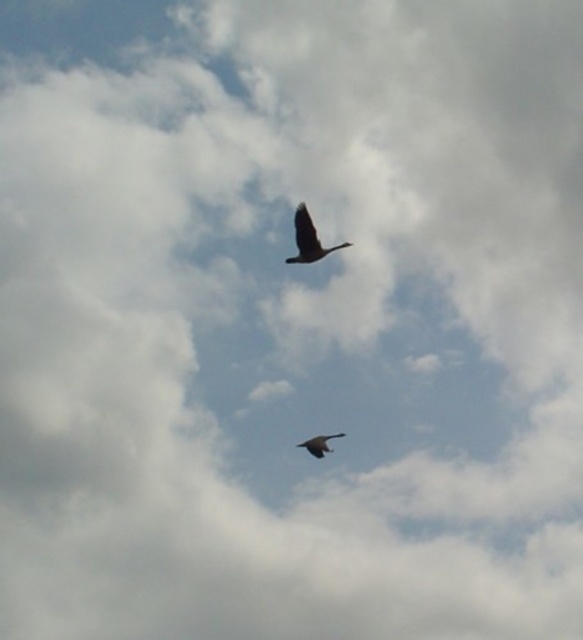
You are a birdwatcher observing the scene. You notice a point marked at coordinates (308, 237). What is the object located at this point?

The point at coordinates (308, 237) marks the location of the dark brown feathered bird at upper center.

You are an ornithologist observing two dark brown feathered birds in the sky. You notice both a dark brown feathered bird at upper center and a dark brown feathered bird at center. Which bird is located higher in the sky?

The dark brown feathered bird at upper center is positioned higher in the sky than the dark brown feathered bird at center.